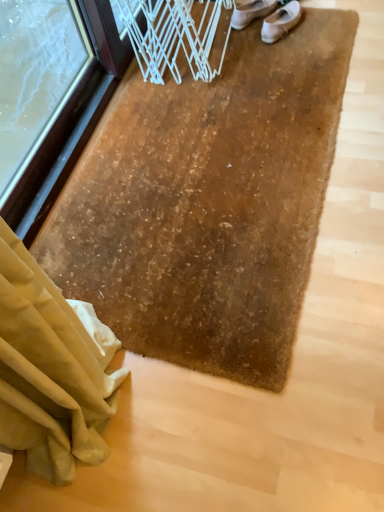
Find the location of a particular element. The width and height of the screenshot is (384, 512). white leather shoes at upper center, the second footwear positioned from the left is located at coordinates (281, 22).

How much space does white leather shoes at upper center, the second footwear positioned from the left, occupy vertically?

3.23 inches.

Describe the element at coordinates (281, 22) in the screenshot. I see `white leather shoes at upper center, the second footwear positioned from the left` at that location.

This screenshot has width=384, height=512. In order to click on white leather shoe at upper center, the first footwear from the left in this screenshot , I will do `click(250, 11)`.

This screenshot has width=384, height=512. What do you see at coordinates (250, 11) in the screenshot?
I see `white leather shoe at upper center, the first footwear from the left` at bounding box center [250, 11].

From the picture: What is the approximate width of white leather shoe at upper center, the first footwear from the left?

The width of white leather shoe at upper center, the first footwear from the left, is 3.80 inches.

Where is `white leather shoes at upper center, which is the 1th footwear in right-to-left order`? Image resolution: width=384 pixels, height=512 pixels. white leather shoes at upper center, which is the 1th footwear in right-to-left order is located at coordinates (281, 22).

Would you say white leather shoes at upper center, which is the 1th footwear in right-to-left order, is to the left or to the right of white leather shoe at upper center, placed as the second footwear when sorted from right to left, in the picture?

Based on their positions, white leather shoes at upper center, which is the 1th footwear in right-to-left order, is located to the right of white leather shoe at upper center, placed as the second footwear when sorted from right to left.

Is white leather shoes at upper center, which is the 1th footwear in right-to-left order, closer to the viewer compared to white leather shoe at upper center, placed as the second footwear when sorted from right to left?

Yes, the depth of white leather shoes at upper center, which is the 1th footwear in right-to-left order, is less than that of white leather shoe at upper center, placed as the second footwear when sorted from right to left.

Considering the points (262, 34) and (240, 7), which point is behind, point (262, 34) or point (240, 7)?

The point (240, 7) is farther.

From the image's perspective, is white leather shoes at upper center, the second footwear positioned from the left, beneath white leather shoe at upper center, the first footwear from the left?

Yes, from the image's perspective, white leather shoes at upper center, the second footwear positioned from the left, is below white leather shoe at upper center, the first footwear from the left.

From a real-world perspective, which object stands above the other?

white leather shoes at upper center, which is the 1th footwear in right-to-left order, is physically above.

Based on the photo, considering the relative sizes of white leather shoes at upper center, which is the 1th footwear in right-to-left order, and white leather shoe at upper center, placed as the second footwear when sorted from right to left, in the image provided, is white leather shoes at upper center, which is the 1th footwear in right-to-left order, wider than white leather shoe at upper center, placed as the second footwear when sorted from right to left,?

Yes.

Is white leather shoes at upper center, the second footwear positioned from the left, shorter than white leather shoe at upper center, the first footwear from the left?

Correct, white leather shoes at upper center, the second footwear positioned from the left, is not as tall as white leather shoe at upper center, the first footwear from the left.

Considering the sizes of objects white leather shoes at upper center, the second footwear positioned from the left, and white leather shoe at upper center, placed as the second footwear when sorted from right to left, in the image provided, who is bigger, white leather shoes at upper center, the second footwear positioned from the left, or white leather shoe at upper center, placed as the second footwear when sorted from right to left,?

With larger size is white leather shoes at upper center, the second footwear positioned from the left.

Do you think white leather shoes at upper center, which is the 1th footwear in right-to-left order, is within white leather shoe at upper center, placed as the second footwear when sorted from right to left, or outside of it?

white leather shoes at upper center, which is the 1th footwear in right-to-left order, is spatially situated outside white leather shoe at upper center, placed as the second footwear when sorted from right to left.

Is white leather shoes at upper center, the second footwear positioned from the left, next to white leather shoe at upper center, placed as the second footwear when sorted from right to left?

Absolutely, white leather shoes at upper center, the second footwear positioned from the left, is next to and touching white leather shoe at upper center, placed as the second footwear when sorted from right to left.

Is white leather shoes at upper center, which is the 1th footwear in right-to-left order, oriented towards white leather shoe at upper center, placed as the second footwear when sorted from right to left?

No.

How far apart are white leather shoes at upper center, the second footwear positioned from the left, and white leather shoe at upper center, placed as the second footwear when sorted from right to left?

They are 8.36 centimeters apart.

Locate an element on the screen. footwear that is under the white leather shoes at upper center, the second footwear positioned from the left (from a real-world perspective) is located at coordinates (250, 11).

Considering the relative positions of white leather shoe at upper center, the first footwear from the left, and white leather shoes at upper center, the second footwear positioned from the left, in the image provided, is white leather shoe at upper center, the first footwear from the left, to the left of white leather shoes at upper center, the second footwear positioned from the left, from the viewer's perspective?

Yes, white leather shoe at upper center, the first footwear from the left, is to the left of white leather shoes at upper center, the second footwear positioned from the left.

Is white leather shoe at upper center, the first footwear from the left, behind white leather shoes at upper center, which is the 1th footwear in right-to-left order?

Yes, white leather shoe at upper center, the first footwear from the left, is behind white leather shoes at upper center, which is the 1th footwear in right-to-left order.

Considering the positions of point (257, 16) and point (263, 22), is point (257, 16) closer or farther from the camera than point (263, 22)?

Point (257, 16).

From the image's perspective, which one is positioned lower, white leather shoe at upper center, the first footwear from the left, or white leather shoes at upper center, the second footwear positioned from the left?

white leather shoes at upper center, the second footwear positioned from the left, from the image's perspective.

In the scene shown: From a real-world perspective, is white leather shoe at upper center, placed as the second footwear when sorted from right to left, located higher than white leather shoes at upper center, which is the 1th footwear in right-to-left order?

No, from a real-world perspective, white leather shoe at upper center, placed as the second footwear when sorted from right to left, is not on top of white leather shoes at upper center, which is the 1th footwear in right-to-left order.

Can you confirm if white leather shoe at upper center, the first footwear from the left, is wider than white leather shoes at upper center, which is the 1th footwear in right-to-left order?

In fact, white leather shoe at upper center, the first footwear from the left, might be narrower than white leather shoes at upper center, which is the 1th footwear in right-to-left order.

In terms of height, does white leather shoe at upper center, the first footwear from the left, look taller or shorter compared to white leather shoes at upper center, the second footwear positioned from the left?

Considering their sizes, white leather shoe at upper center, the first footwear from the left, has more height than white leather shoes at upper center, the second footwear positioned from the left.

Considering the sizes of objects white leather shoe at upper center, the first footwear from the left, and white leather shoes at upper center, the second footwear positioned from the left, in the image provided, who is bigger, white leather shoe at upper center, the first footwear from the left, or white leather shoes at upper center, the second footwear positioned from the left,?

white leather shoes at upper center, the second footwear positioned from the left.

Would you say white leather shoes at upper center, the second footwear positioned from the left, is part of white leather shoe at upper center, placed as the second footwear when sorted from right to left,'s contents?

No, white leather shoes at upper center, the second footwear positioned from the left, is not surrounded by white leather shoe at upper center, placed as the second footwear when sorted from right to left.

Is white leather shoe at upper center, the first footwear from the left, far away from white leather shoes at upper center, which is the 1th footwear in right-to-left order?

They are positioned close to each other.

Is white leather shoe at upper center, the first footwear from the left, turned away from white leather shoes at upper center, which is the 1th footwear in right-to-left order?

Yes, white leather shoe at upper center, the first footwear from the left, is facing away from white leather shoes at upper center, which is the 1th footwear in right-to-left order.

You are a GUI agent. You are given a task and a screenshot of the screen. Output one action in this format:
    pyautogui.click(x=<x>, y=<y>)
    Task: Click on the footwear below the white leather shoes at upper center, the second footwear positioned from the left (from a real-world perspective)
    
    Given the screenshot: What is the action you would take?
    pyautogui.click(x=250, y=11)

Where is `footwear located on the left of white leather shoes at upper center, the second footwear positioned from the left`? footwear located on the left of white leather shoes at upper center, the second footwear positioned from the left is located at coordinates (250, 11).

You are a GUI agent. You are given a task and a screenshot of the screen. Output one action in this format:
    pyautogui.click(x=<x>, y=<y>)
    Task: Click on the footwear below the white leather shoe at upper center, placed as the second footwear when sorted from right to left (from the image's perspective)
    The image size is (384, 512).
    Given the screenshot: What is the action you would take?
    pyautogui.click(x=281, y=22)